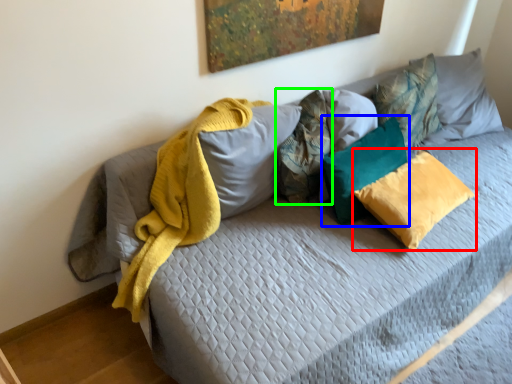
Question: Based on their relative distances, which object is farther from pillow (highlighted by a red box)? Choose from pillow (highlighted by a blue box) and pillow (highlighted by a green box).

Choices:
 (A) pillow
 (B) pillow

Answer: (B)